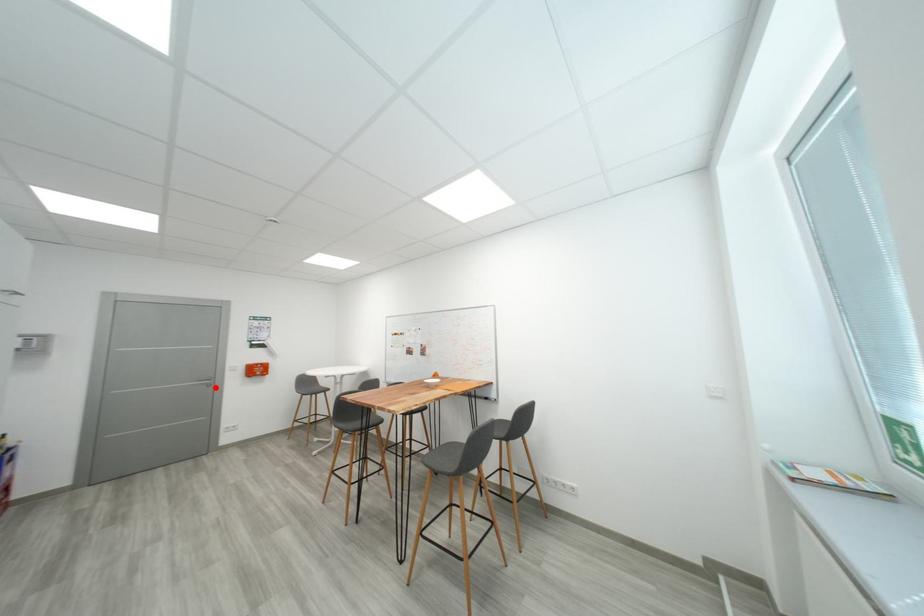
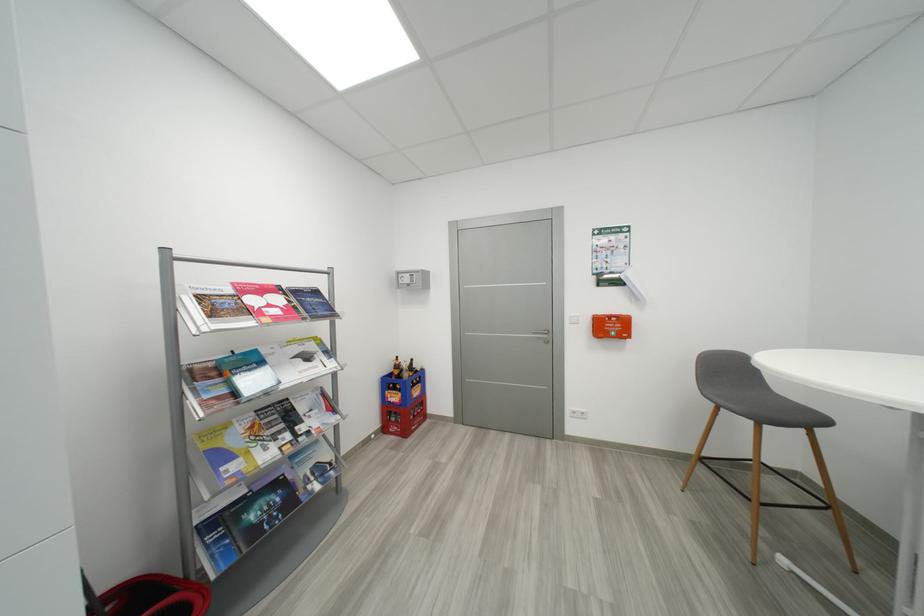
In the second image, find the point that corresponds to the highlighted location in the first image.

(553, 344)